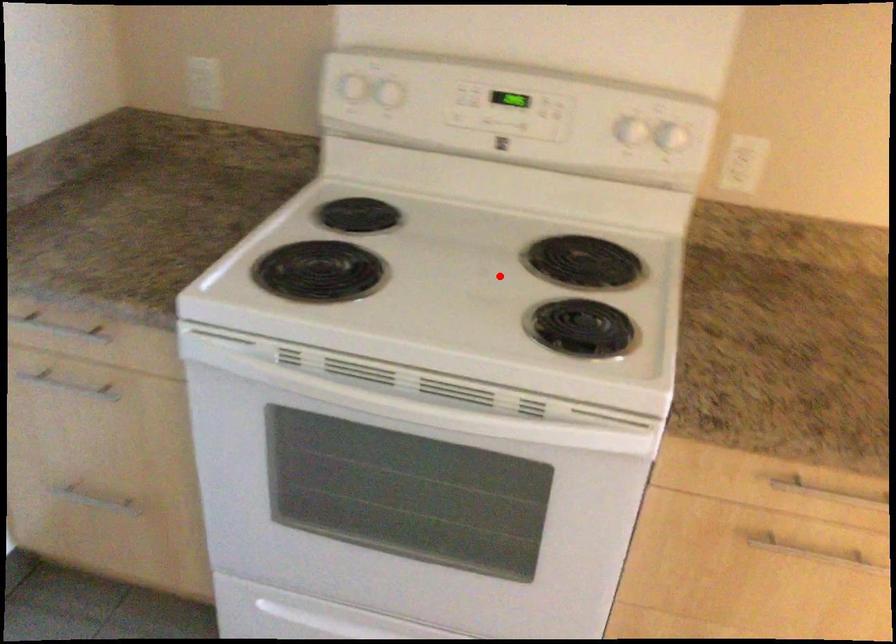
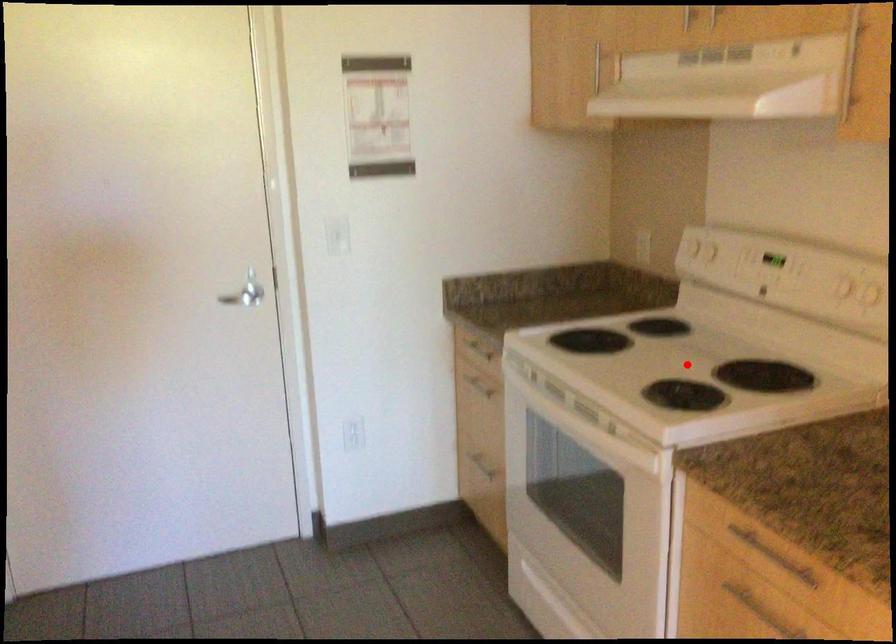
I am providing you with two images of the same scene from different viewpoints. A red point is marked on the first image and another point is marked on the second image. Do the highlighted points in image1 and image2 indicate the same real-world spot?

Yes